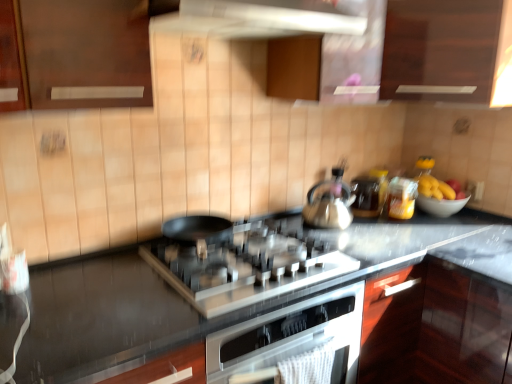
Locate an element on the screen. Image resolution: width=512 pixels, height=384 pixels. vacant space in front of satin silver kettle at center is located at coordinates (366, 241).